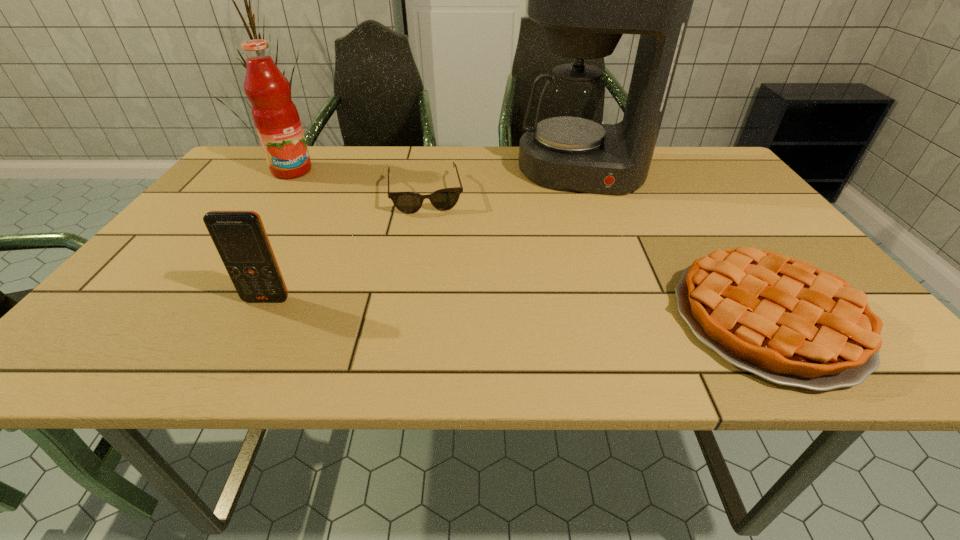
The height and width of the screenshot is (540, 960). What are the coordinates of `free space located 0.230m on the front lenses of the sunglasses` in the screenshot? It's located at (436, 273).

The width and height of the screenshot is (960, 540). In order to click on blank area located on the button side of the coffee maker in this screenshot , I will do click(x=581, y=241).

Find the location of a particular element. The image size is (960, 540). vacant space situated 0.300m on the button side of the coffee maker is located at coordinates (582, 268).

At what (x,y) coordinates should I click in order to perform the action: click on free space located on the button side of the coffee maker. Please return your answer as a coordinate pair (x, y). This screenshot has height=540, width=960. Looking at the image, I should click on (581, 212).

Identify the location of free space located 0.270m on the front label of the leftmost object. This screenshot has width=960, height=540. (345, 219).

In order to click on vacant area situated 0.200m on the front label of the leftmost object in this screenshot , I will do `click(332, 207)`.

Identify the location of vacant point located 0.190m on the front label of the leftmost object. (330, 205).

You are a GUI agent. You are given a task and a screenshot of the screen. Output one action in this format:
    pyautogui.click(x=<x>, y=<y>)
    Task: Click on the sunglasses at the far edge
    The height and width of the screenshot is (540, 960).
    Given the screenshot: What is the action you would take?
    pyautogui.click(x=444, y=199)

I want to click on coffee maker that is at the far edge, so click(585, 0).

Identify the location of fruit juice that is at the far edge. (x=275, y=116).